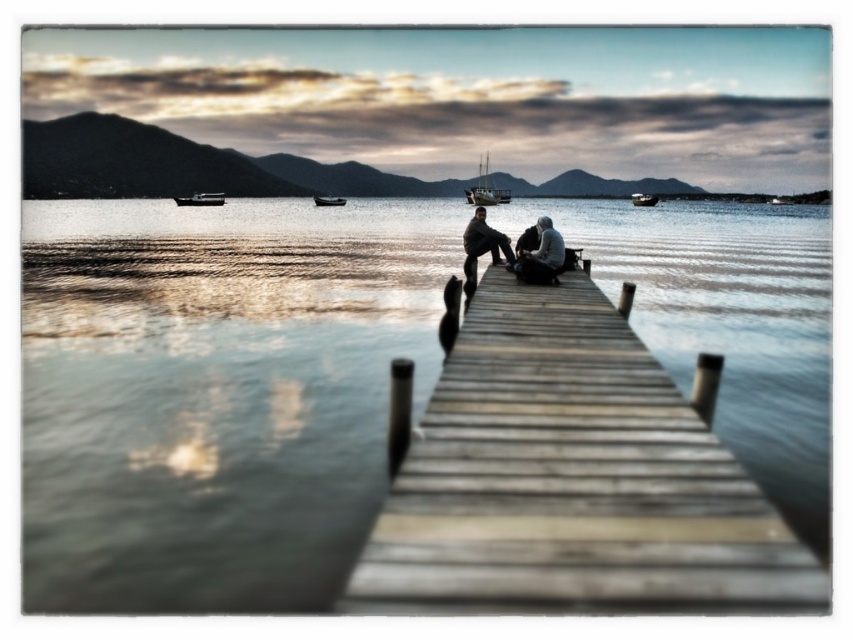
Is smooth gray sweater at center to the left of metallic gray boat at lower left from the viewer's perspective?

In fact, smooth gray sweater at center is to the right of metallic gray boat at lower left.

Which is below, smooth gray sweater at center or metallic gray boat at lower left?

smooth gray sweater at center

Who is more forward, (x=541, y=248) or (x=224, y=198)?

Point (x=541, y=248) is more forward.

Find the location of a particular element. The height and width of the screenshot is (640, 853). smooth gray sweater at center is located at coordinates (541, 256).

Does dark gray fabric jacket at center appear on the left side of metallic silver boat at center?

Correct, you'll find dark gray fabric jacket at center to the left of metallic silver boat at center.

Where is `dark gray fabric jacket at center`? dark gray fabric jacket at center is located at coordinates (485, 241).

Is point (492, 250) closer to viewer compared to point (637, 202)?

Yes.

In order to click on dark gray fabric jacket at center in this screenshot , I will do `click(485, 241)`.

Consider the image. Is dark gray matte boat at center positioned behind metallic silver boat at center?

No, it is not.

Is dark gray matte boat at center smaller than metallic silver boat at center?

Incorrect, dark gray matte boat at center is not smaller in size than metallic silver boat at center.

Is point (325, 196) more distant than point (653, 198)?

That is False.

What are the coordinates of `dark gray matte boat at center` in the screenshot? It's located at (328, 200).